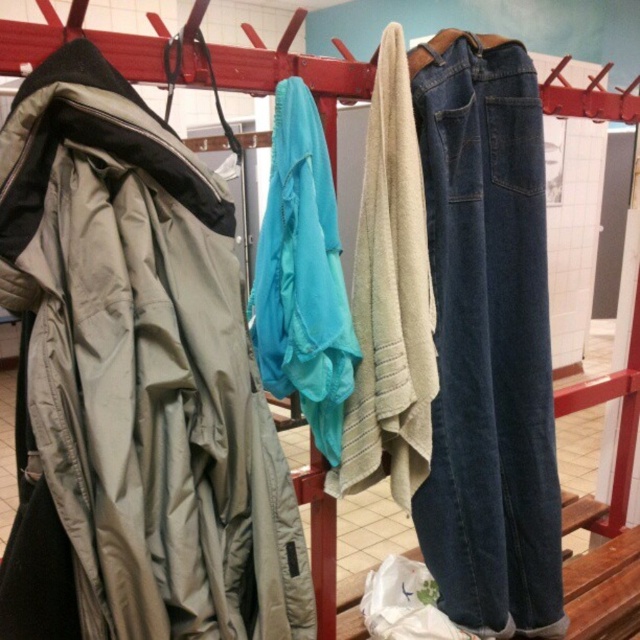
You are standing in a bathroom and see two points marked in the scene. The first point is at coordinate point (509, 579) and the second is at point (406, 138). From your perspective, which point is closer to you?

Point (406, 138) is closer to you because it is in front of point (509, 579) according to their spatial arrangement.

You are organizing towels in a bathroom and need to place the beige towel at center and the matte blue towel at center on a shelf. The shelf has limited vertical space. Which towel should you place first to ensure both fit without overlapping?

The beige towel at center is taller than the matte blue towel at center, so place the beige towel at center first on the lower shelf and the matte blue towel at center on top to ensure they both fit without overlapping.